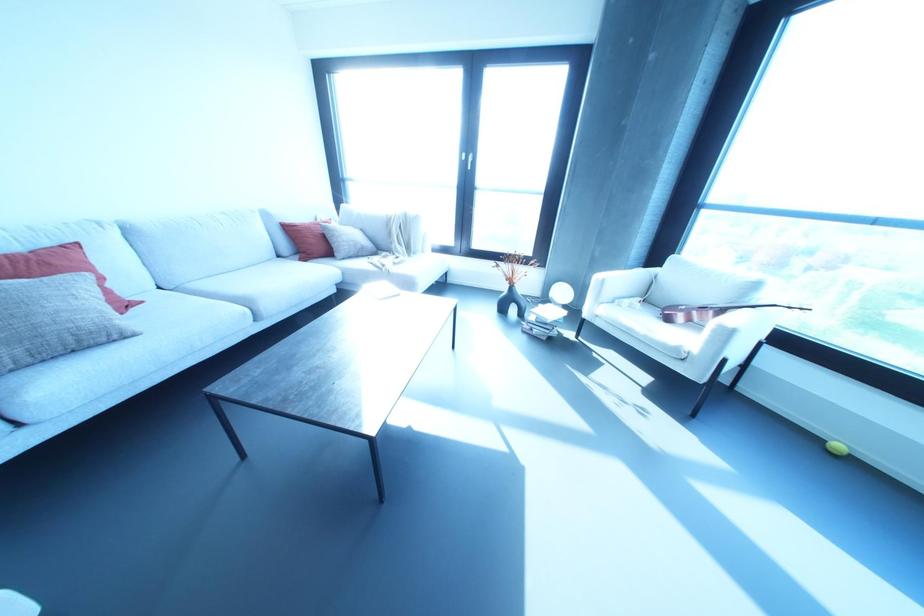
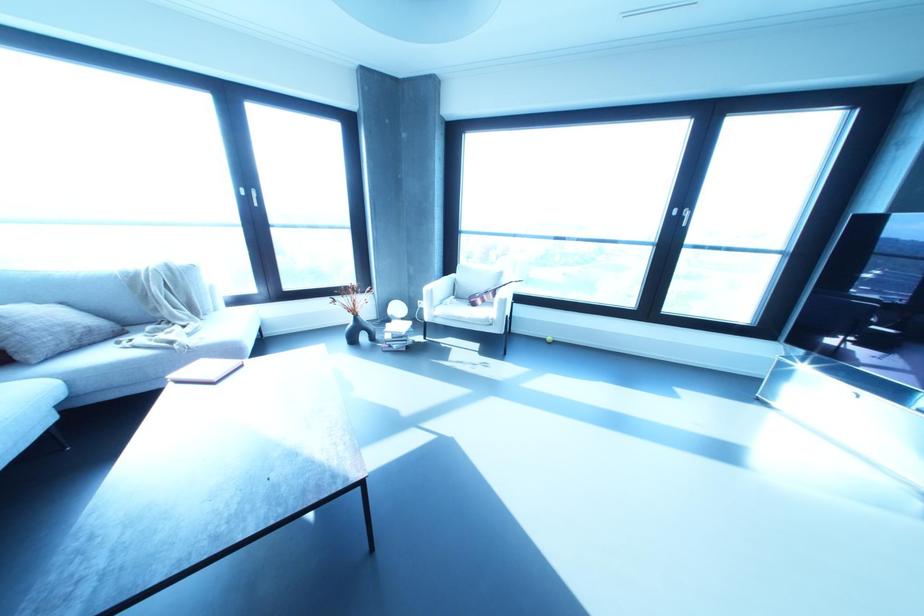
Where in the second image is the point corresponding to (x=468, y=168) from the first image?

(254, 205)